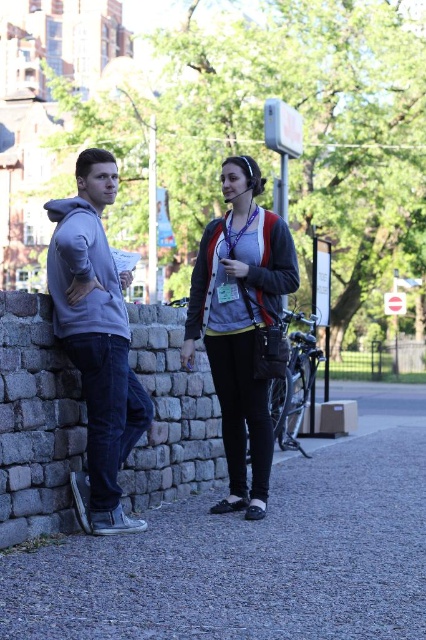
Between gray gravel pavement at lower center and matte black jacket at center, which one is positioned higher?

Positioned higher is matte black jacket at center.

Can you confirm if gray gravel pavement at lower center is positioned to the left of matte black jacket at center?

In fact, gray gravel pavement at lower center is to the right of matte black jacket at center.

Where is `gray gravel pavement at lower center`? The width and height of the screenshot is (426, 640). gray gravel pavement at lower center is located at coordinates click(x=247, y=561).

Is matte black jacket at center to the right of matte gray hoodie at left from the viewer's perspective?

Indeed, matte black jacket at center is positioned on the right side of matte gray hoodie at left.

Does matte black jacket at center have a greater height compared to matte gray hoodie at left?

In fact, matte black jacket at center may be shorter than matte gray hoodie at left.

Between point (187, 364) and point (109, 452), which one is positioned behind?

The point (187, 364) is behind.

The width and height of the screenshot is (426, 640). Identify the location of matte black jacket at center. (241, 323).

Is point (55, 566) positioned after point (97, 378)?

No, (55, 566) is in front of (97, 378).

Does gray gravel pavement at lower center come behind matte gray hoodie at left?

No, gray gravel pavement at lower center is in front of matte gray hoodie at left.

Where is `gray gravel pavement at lower center`? gray gravel pavement at lower center is located at coordinates (247, 561).